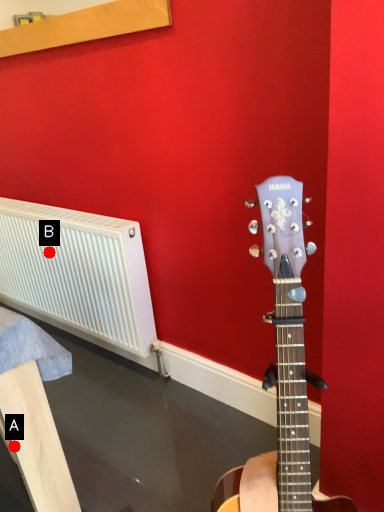
Question: Two points are circled on the image, labeled by A and B beside each circle. Among these points, which one is farthest from the camera?

Choices:
 (A) A is further
 (B) B is further

Answer: (B)